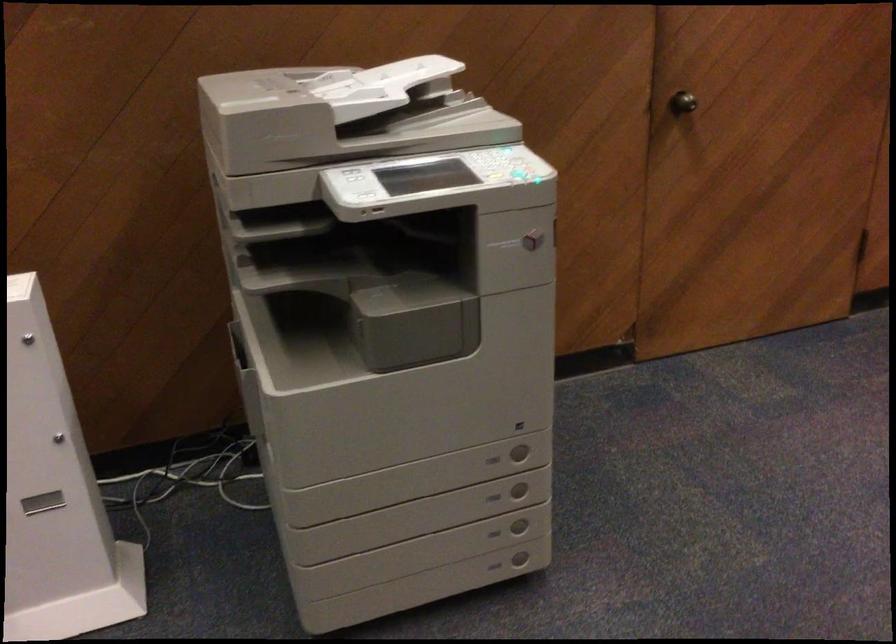
Where would you lift the document feeder tray? Please return your answer as a coordinate pair (x, y).

(376, 86)